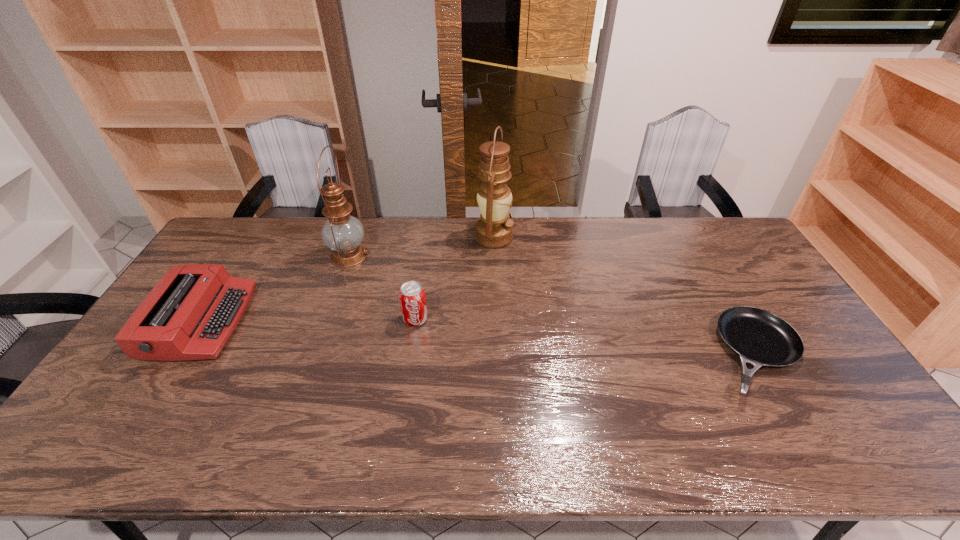
The image size is (960, 540). In order to click on the fourth object from left to right in this screenshot , I will do `click(494, 230)`.

Find the location of a particular element. the left oil lamp is located at coordinates (342, 233).

The image size is (960, 540). I want to click on the third object from left to right, so click(412, 298).

The height and width of the screenshot is (540, 960). What are the coordinates of `the third tallest object` in the screenshot? It's located at (412, 298).

Identify the location of the second shortest object. (191, 313).

Where is `the leftmost object`? the leftmost object is located at coordinates (191, 313).

The width and height of the screenshot is (960, 540). I want to click on pan, so click(x=760, y=338).

Locate an element on the screen. the rightmost object is located at coordinates (760, 338).

I want to click on vacant space located 0.330m on the left of the right oil lamp, so click(385, 237).

You are a GUI agent. You are given a task and a screenshot of the screen. Output one action in this format:
    pyautogui.click(x=<x>, y=<y>)
    Task: Click on the vacant space situated 0.160m on the right of the second object from left to right
    The height and width of the screenshot is (540, 960).
    Given the screenshot: What is the action you would take?
    pyautogui.click(x=415, y=255)